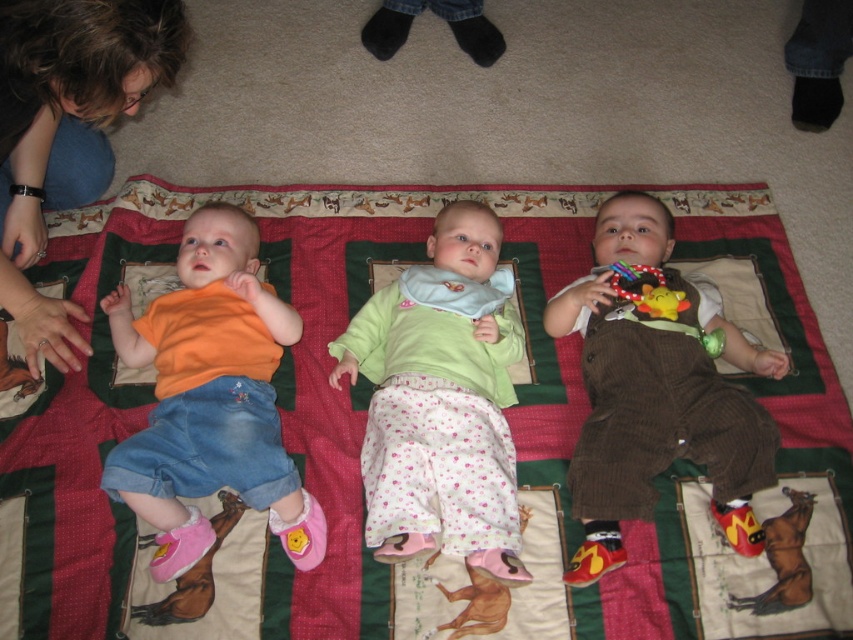
Does multicolored quilt at center appear on the right side of brown corduroy overalls at center?

Incorrect, multicolored quilt at center is not on the right side of brown corduroy overalls at center.

Looking at this image, can you confirm if multicolored quilt at center is thinner than brown corduroy overalls at center?

No, multicolored quilt at center is not thinner than brown corduroy overalls at center.

Locate an element on the screen. multicolored quilt at center is located at coordinates (361, 435).

This screenshot has height=640, width=853. In order to click on multicolored quilt at center in this screenshot , I will do `click(361, 435)`.

Looking at this image, does multicolored quilt at center appear under rubber teething ring at lower left?

Correct, multicolored quilt at center is located below rubber teething ring at lower left.

Can you confirm if multicolored quilt at center is taller than rubber teething ring at lower left?

Indeed, multicolored quilt at center has a greater height compared to rubber teething ring at lower left.

Who is more distant from viewer, (694, 538) or (47, 339)?

The point (47, 339) is behind.

Where is `multicolored quilt at center`? This screenshot has height=640, width=853. multicolored quilt at center is located at coordinates (361, 435).

Which is more to the left, brown corduroy overalls at center or brown hair at upper left?

From the viewer's perspective, brown hair at upper left appears more on the left side.

Who is more forward, (630, 211) or (51, 76)?

Point (51, 76)

Find the location of a particular element. This screenshot has height=640, width=853. brown corduroy overalls at center is located at coordinates (657, 388).